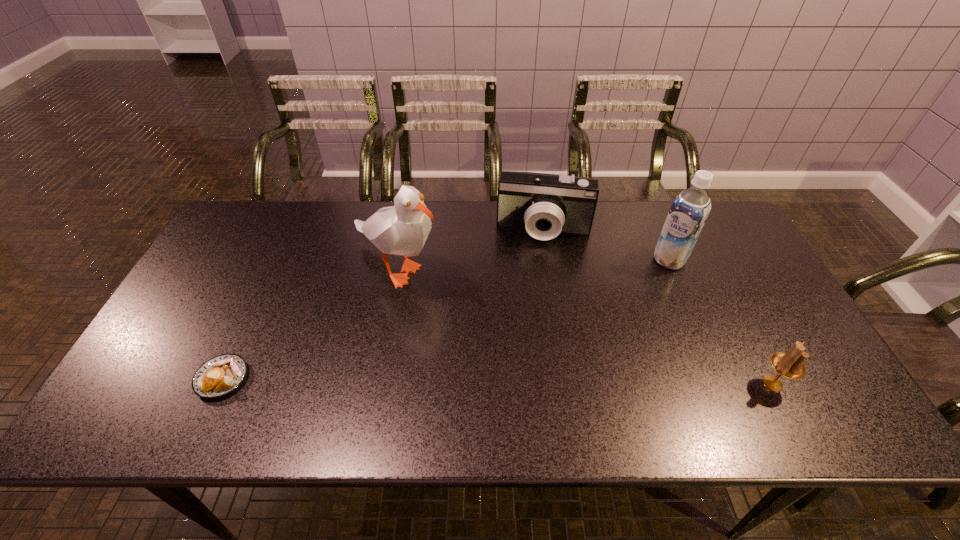
You are a GUI agent. You are given a task and a screenshot of the screen. Output one action in this format:
    pyautogui.click(x=<x>, y=<y>)
    Task: Click on the free area in between the second object from right to left and the third object from right to left
    
    Given the screenshot: What is the action you would take?
    pyautogui.click(x=607, y=245)

What are the coordinates of `free space that is in between the rightmost object and the leftmost object` in the screenshot? It's located at (497, 381).

Identify the location of the second closest object to the third object from right to left. The height and width of the screenshot is (540, 960). (688, 213).

Find the location of a particular element. This screenshot has height=540, width=960. object identified as the second closest to the shortest object is located at coordinates (545, 205).

Image resolution: width=960 pixels, height=540 pixels. Find the location of `vacant region that satisfies the following two spatial constraints: 1. on the front side of the candle holder; 2. on the left side of the soya milk`. vacant region that satisfies the following two spatial constraints: 1. on the front side of the candle holder; 2. on the left side of the soya milk is located at coordinates (723, 383).

Where is `vacant area in the image that satisfies the following two spatial constraints: 1. on the back side of the camcorder; 2. on the right side of the second object from left to right`? The height and width of the screenshot is (540, 960). vacant area in the image that satisfies the following two spatial constraints: 1. on the back side of the camcorder; 2. on the right side of the second object from left to right is located at coordinates (403, 231).

Find the location of a particular element. vacant space that satisfies the following two spatial constraints: 1. on the back side of the third object from right to left; 2. on the right side of the leftmost object is located at coordinates (290, 231).